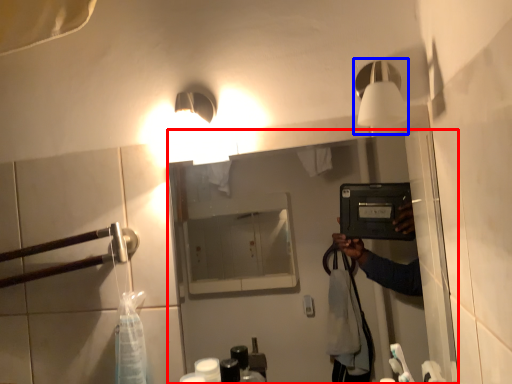
Question: Which object appears farthest to the camera in this image, mirror (highlighted by a red box) or light fixture (highlighted by a blue box)?

Choices:
 (A) mirror
 (B) light fixture

Answer: (A)